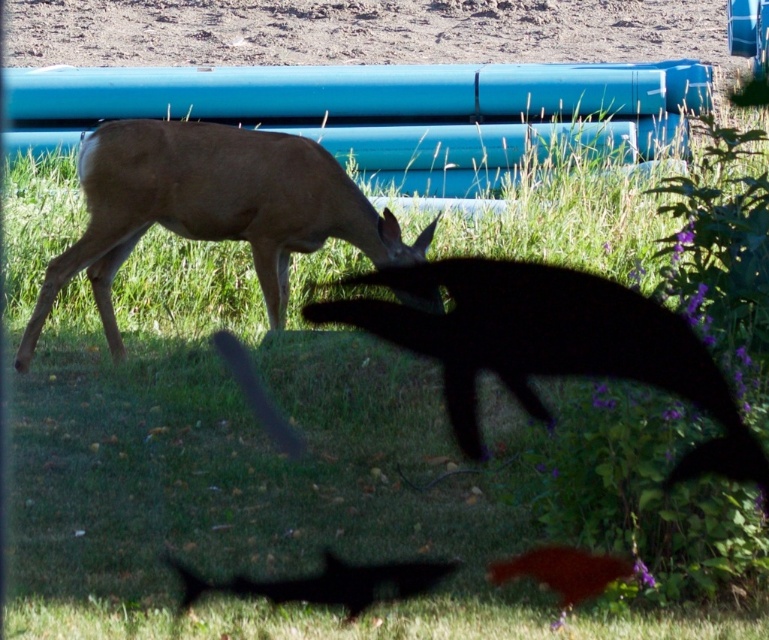
Question: Is black matte dog at center to the left of black matte deer at lower center from the viewer's perspective?

Choices:
 (A) yes
 (B) no

Answer: (B)

Question: Estimate the real-world distances between objects in this image. Which object is closer to the brown matte deer at center?

Choices:
 (A) black matte deer at lower center
 (B) black matte dog at center

Answer: (B)

Question: Which object appears farthest from the camera in this image?

Choices:
 (A) black matte dog at center
 (B) brown matte deer at center
 (C) black matte deer at lower center

Answer: (B)

Question: Is black matte dog at center behind black matte deer at lower center?

Choices:
 (A) yes
 (B) no

Answer: (B)

Question: Which of these objects is positioned closest to the black matte dog at center?

Choices:
 (A) brown matte deer at center
 (B) black matte deer at lower center

Answer: (A)

Question: Can you confirm if black matte dog at center is positioned above brown matte deer at center?

Choices:
 (A) no
 (B) yes

Answer: (A)